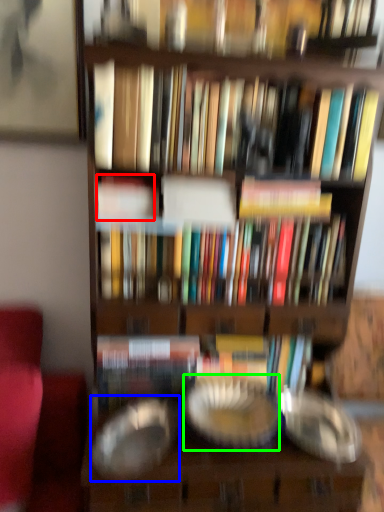
Question: Estimate the real-world distances between objects in this image. Which object is closer to book (highlighted by a red box), glass plate (highlighted by a blue box) or glass plate (highlighted by a green box)?

Choices:
 (A) glass plate
 (B) glass plate

Answer: (A)